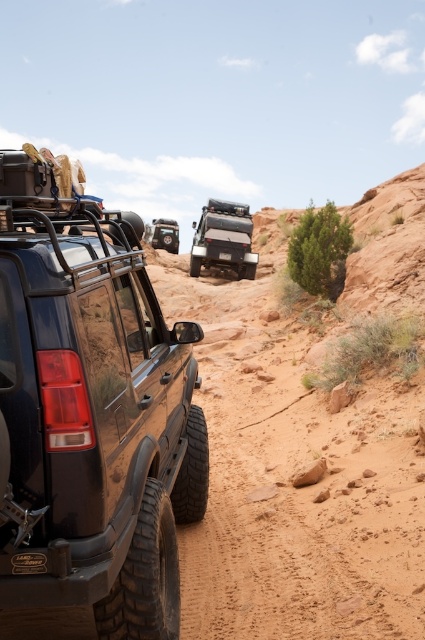
Based on the photo, who is higher up, matte black jeep at center or matte black tire at center?

Positioned higher is matte black tire at center.

Describe the element at coordinates (223, 237) in the screenshot. I see `matte black jeep at center` at that location.

Between point (215, 259) and point (156, 228), which one is positioned in front?

Point (215, 259) is in front.

You are a GUI agent. You are given a task and a screenshot of the screen. Output one action in this format:
    pyautogui.click(x=<x>, y=<y>)
    Task: Click on the matte black jeep at center
    This screenshot has height=640, width=425.
    Given the screenshot: What is the action you would take?
    pyautogui.click(x=223, y=237)

Looking at this image, between matte black suv at left and matte black tire at center, which one has more height?

With more height is matte black suv at left.

Consider the image. Does matte black suv at left appear under matte black tire at center?

Yes.

Who is more distant from viewer, (62, 538) or (158, 221)?

The point (158, 221) is more distant.

This screenshot has height=640, width=425. In order to click on matte black suv at left in this screenshot , I will do [90, 413].

Can you confirm if matte black suv at left is positioned to the left of matte black jeep at center?

Indeed, matte black suv at left is positioned on the left side of matte black jeep at center.

Is matte black suv at left behind matte black jeep at center?

That is False.

Is point (95, 577) positioned behind point (215, 257)?

No, (95, 577) is closer to viewer.

Identify the location of matte black suv at left. (90, 413).